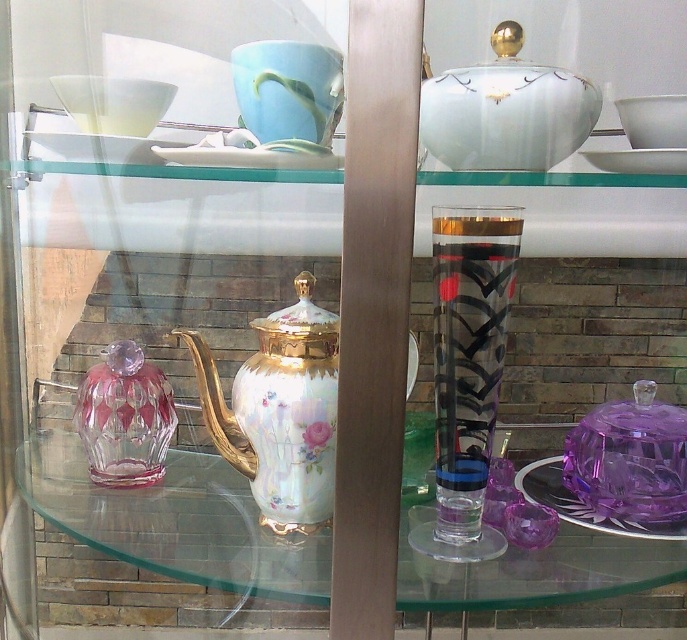
What do you see at coordinates (471, 330) in the screenshot?
I see `translucent black and white vase at center` at bounding box center [471, 330].

Which is below, translucent black and white vase at center or transparent glass bowl at upper left?

translucent black and white vase at center is below.

Where is `translucent black and white vase at center`? The image size is (687, 640). translucent black and white vase at center is located at coordinates (471, 330).

Find the location of `translucent black and white vase at center`. translucent black and white vase at center is located at coordinates (471, 330).

Which is more to the right, transparent glass table at center or ruby crystal vase at left?

transparent glass table at center is more to the right.

Who is taller, transparent glass table at center or ruby crystal vase at left?

ruby crystal vase at left

The height and width of the screenshot is (640, 687). What do you see at coordinates (174, 522) in the screenshot?
I see `transparent glass table at center` at bounding box center [174, 522].

You are a GUI agent. You are given a task and a screenshot of the screen. Output one action in this format:
    pyautogui.click(x=<x>, y=<y>)
    Task: Click on the transparent glass table at center
    This screenshot has width=687, height=640.
    Given the screenshot: What is the action you would take?
    pyautogui.click(x=174, y=522)

Between porcelain/hand-painted teapot at center and ruby crystal vase at left, which one has more height?

porcelain/hand-painted teapot at center is taller.

Between porcelain/hand-painted teapot at center and ruby crystal vase at left, which one has less height?

Standing shorter between the two is ruby crystal vase at left.

Locate an element on the screen. porcelain/hand-painted teapot at center is located at coordinates (280, 410).

This screenshot has height=640, width=687. In order to click on porcelain/hand-painted teapot at center in this screenshot , I will do `click(280, 410)`.